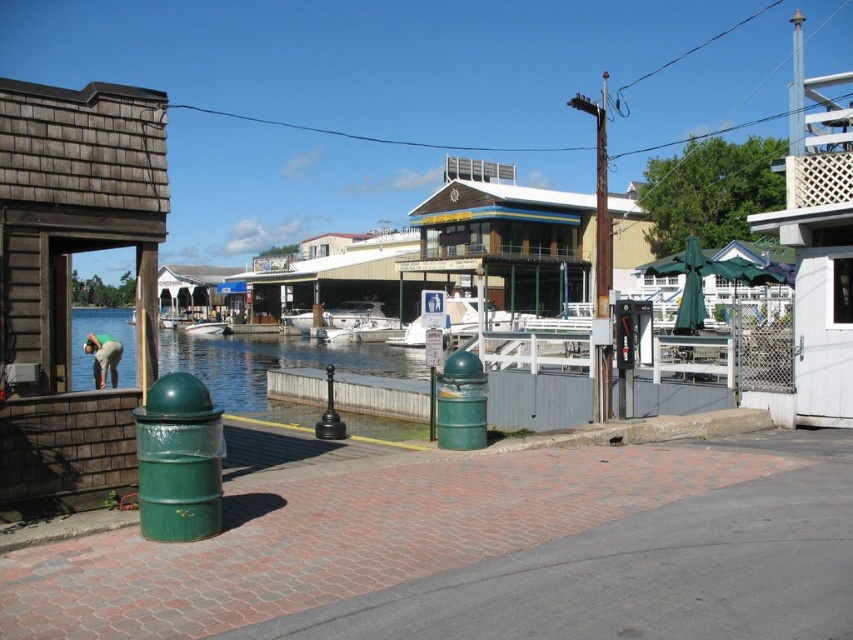
Question: Can you confirm if rusty metal pole at center-right is smaller than white glossy boat at center?

Choices:
 (A) no
 (B) yes

Answer: (A)

Question: Which object is farther from the camera taking this photo?

Choices:
 (A) rusty metal pole at center-right
 (B) white glossy boat at center

Answer: (B)

Question: Is rusty metal pole at center-right thinner than white glossy boat at center?

Choices:
 (A) no
 (B) yes

Answer: (A)

Question: Does rusty metal pole at center-right come behind white glossy boat at center?

Choices:
 (A) yes
 (B) no

Answer: (B)

Question: Which object is farther from the camera taking this photo?

Choices:
 (A) white glossy boat at center
 (B) rusty metal pole at center-right

Answer: (A)